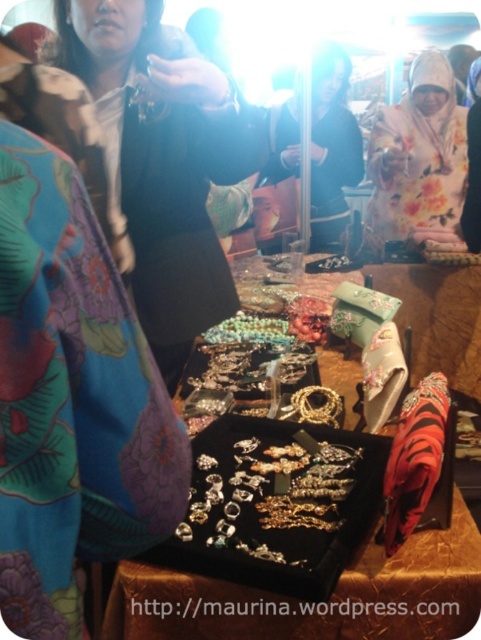
Question: Can you confirm if floral silk robe at upper right is positioned above floral silk scarf at center?

Choices:
 (A) no
 (B) yes

Answer: (A)

Question: Is matte black jacket at center wider than floral silk scarf at center?

Choices:
 (A) no
 (B) yes

Answer: (A)

Question: Which point is farther from the camera taking this photo?

Choices:
 (A) (213, 540)
 (B) (164, 164)
 (C) (414, 65)
 (D) (353, 164)

Answer: (D)

Question: Which object is positioned farthest from the floral silk scarf at center?

Choices:
 (A) floral silk robe at upper right
 (B) black velvet jewelry at center
 (C) matte black jacket at center
 (D) silver metallic earrings at center

Answer: (D)

Question: Can you confirm if matte black jacket at center is positioned below floral silk robe at upper right?

Choices:
 (A) yes
 (B) no

Answer: (A)

Question: Considering the real-world distances, which object is farthest from the silver metallic earrings at center?

Choices:
 (A) floral silk robe at upper right
 (B) floral silk scarf at center
 (C) black velvet jewelry at center

Answer: (B)